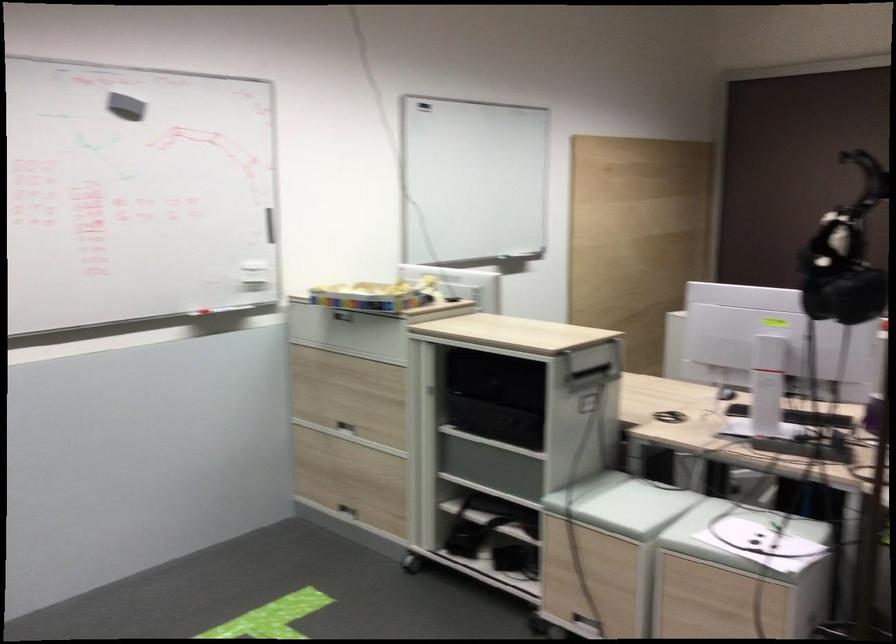
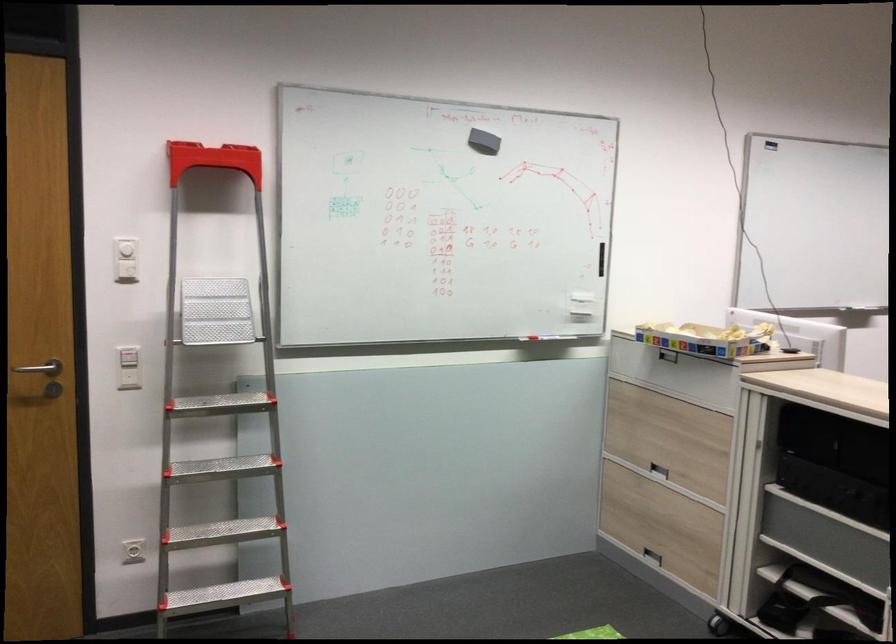
The point at (483, 521) is marked in the first image. Where is the corresponding point in the second image?

(814, 603)